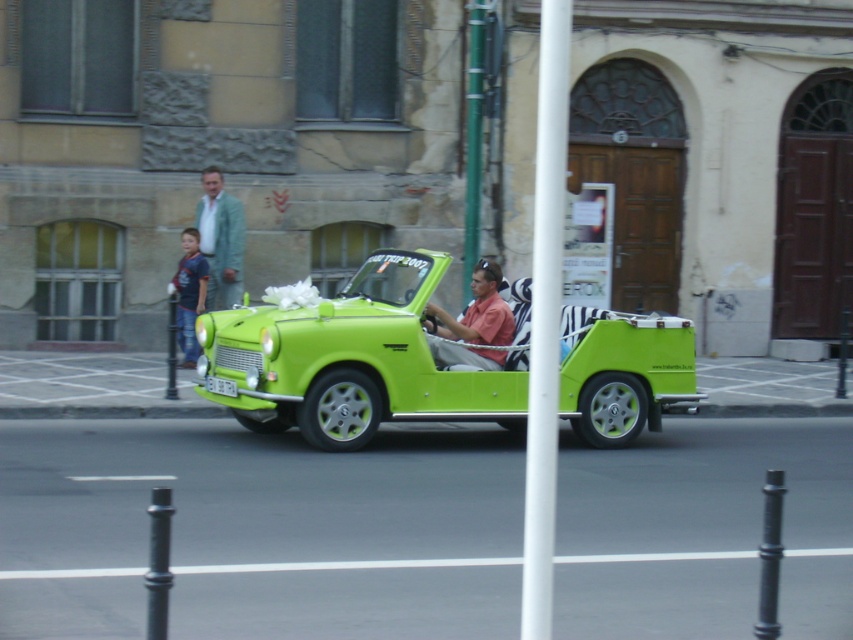
Question: Is light blue fabric jacket at upper left positioned behind blue denim jeans at left?

Choices:
 (A) no
 (B) yes

Answer: (B)

Question: Among these points, which one is farthest from the camera?

Choices:
 (A) (469, 0)
 (B) (531, 310)
 (C) (250, 372)
 (D) (193, 368)

Answer: (A)

Question: Considering the real-world distances, which object is farthest from the green metallic pole at center?

Choices:
 (A) light blue fabric jacket at upper left
 (B) pink matte shirt at center
 (C) white plastic pole at center

Answer: (C)

Question: Where is pink matte shirt at center located in relation to blue denim jeans at left in the image?

Choices:
 (A) below
 (B) above

Answer: (A)

Question: Which object is positioned farthest from the lime green plastic car at center?

Choices:
 (A) white plastic pole at center
 (B) pink matte shirt at center
 (C) green metallic pole at center
 (D) light blue fabric jacket at upper left

Answer: (D)

Question: Does light blue fabric jacket at upper left appear on the left side of green metallic pole at center?

Choices:
 (A) yes
 (B) no

Answer: (A)